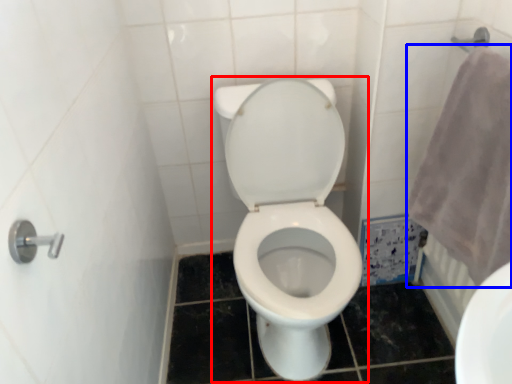
Question: Which object appears farthest to the camera in this image, toilet (highlighted by a red box) or bath towel (highlighted by a blue box)?

Choices:
 (A) toilet
 (B) bath towel

Answer: (A)